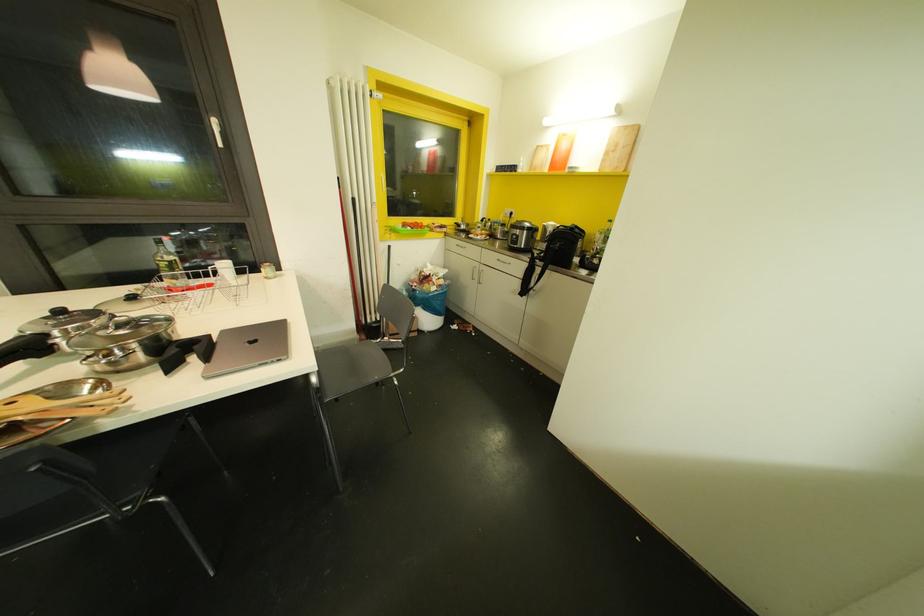
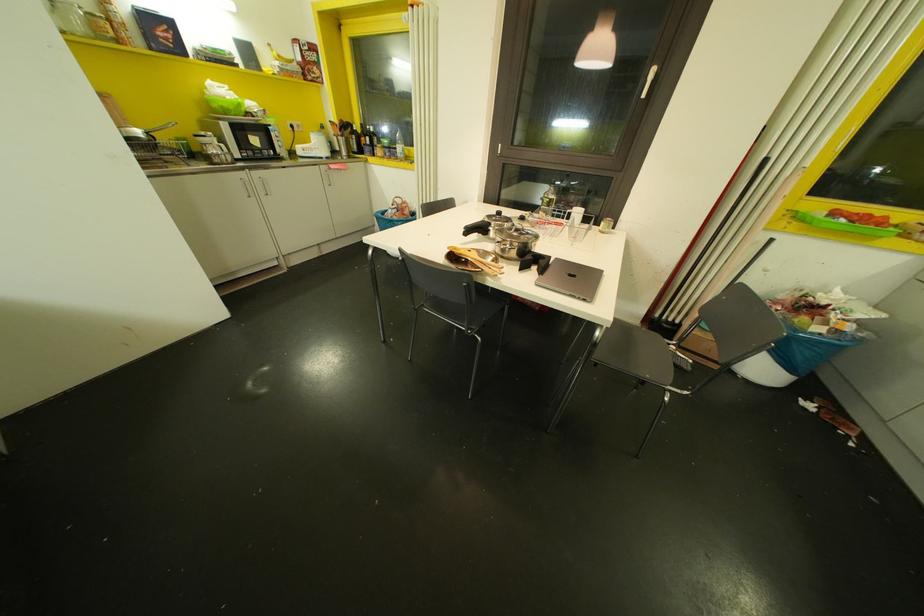
The first image is from the beginning of the video and the second image is from the end. How did the camera likely rotate when shooting the video?

The camera's rotation is toward left-down.